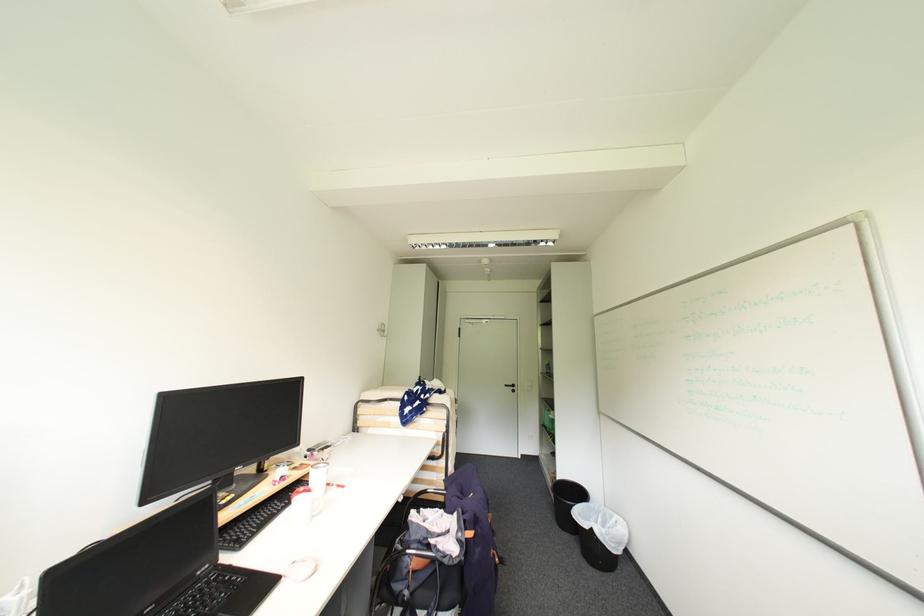
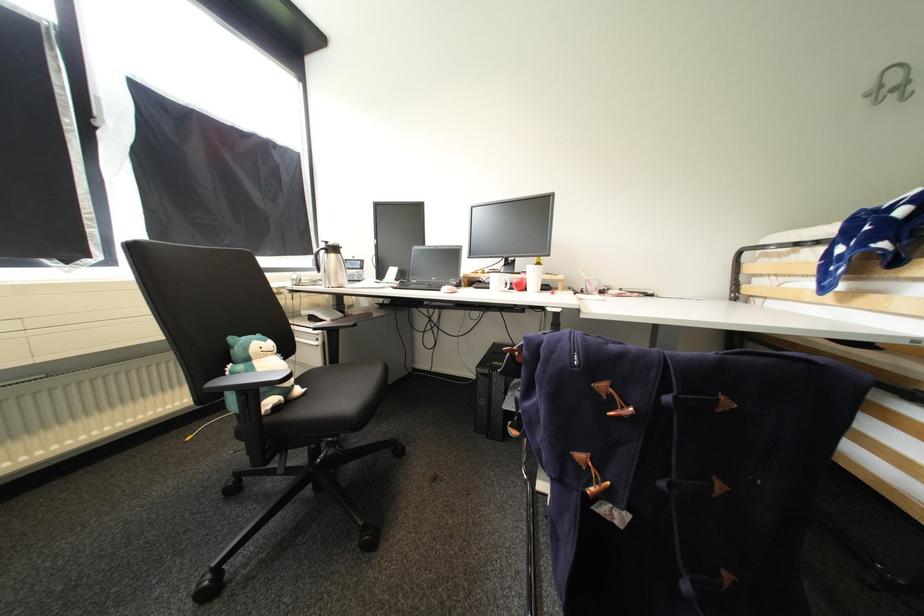
Find the pixel in the second image that matches the point at 334,475 in the first image.

(541, 273)